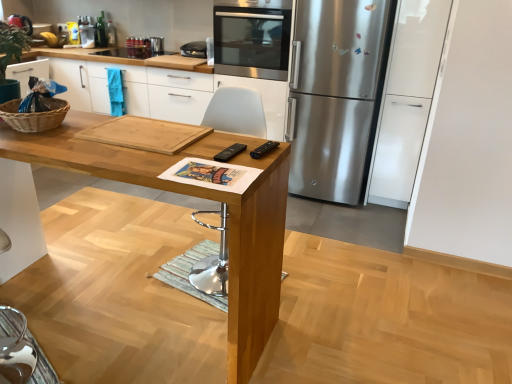
Question: Considering the positions of natural wood cutting board at center and natural wood cutting board at center in the image, is natural wood cutting board at center bigger or smaller than natural wood cutting board at center?

Choices:
 (A) small
 (B) big

Answer: (A)

Question: From a real-world perspective, is natural wood cutting board at center physically located above or below natural wood cutting board at center?

Choices:
 (A) above
 (B) below

Answer: (A)

Question: Which is nearer to the white plastic chair at center?

Choices:
 (A) natural wood cutting board at center
 (B) natural wood table at center
 (C) stainless steel refrigerator at right
 (D) natural wood cutting board at center
 (E) stainless steel oven at upper center

Answer: (B)

Question: Estimate the real-world distances between objects in this image. Which object is closer to the natural wood table at center?

Choices:
 (A) stainless steel refrigerator at right
 (B) white plastic chair at center
 (C) natural wood cutting board at center
 (D) stainless steel oven at upper center
 (E) woven brown basket at left

Answer: (E)